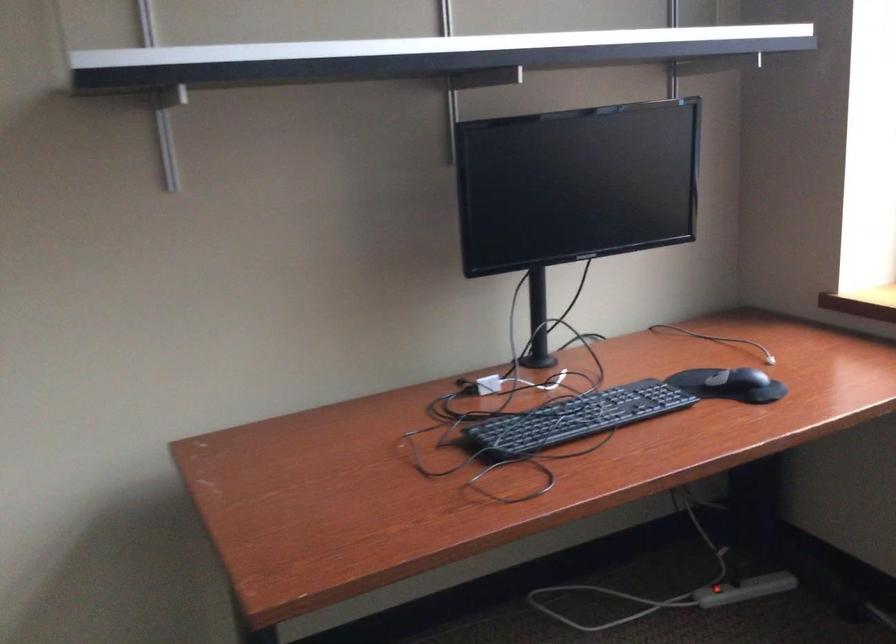
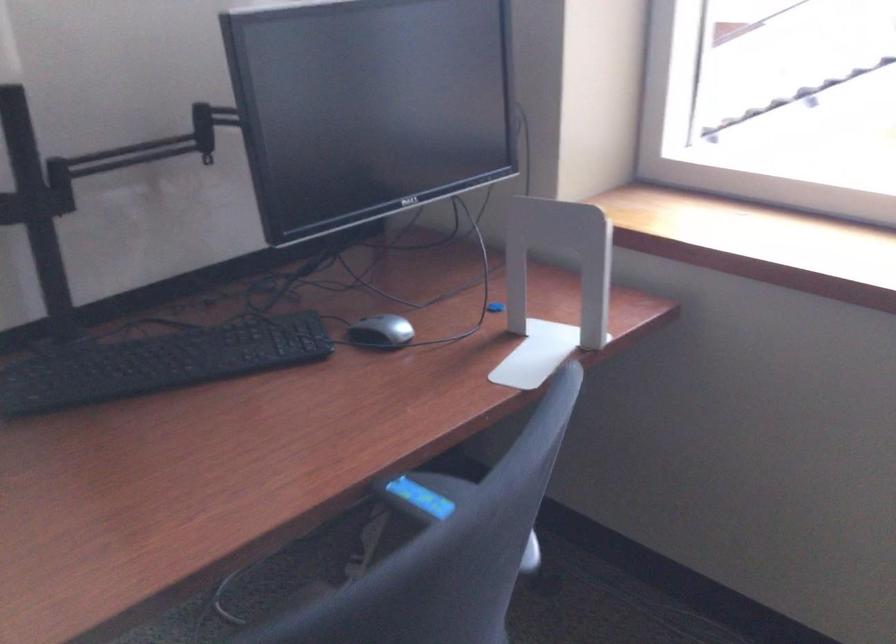
The images are taken continuously from a first-person perspective. In which direction are you moving?

The cameraman walked toward right, backward.